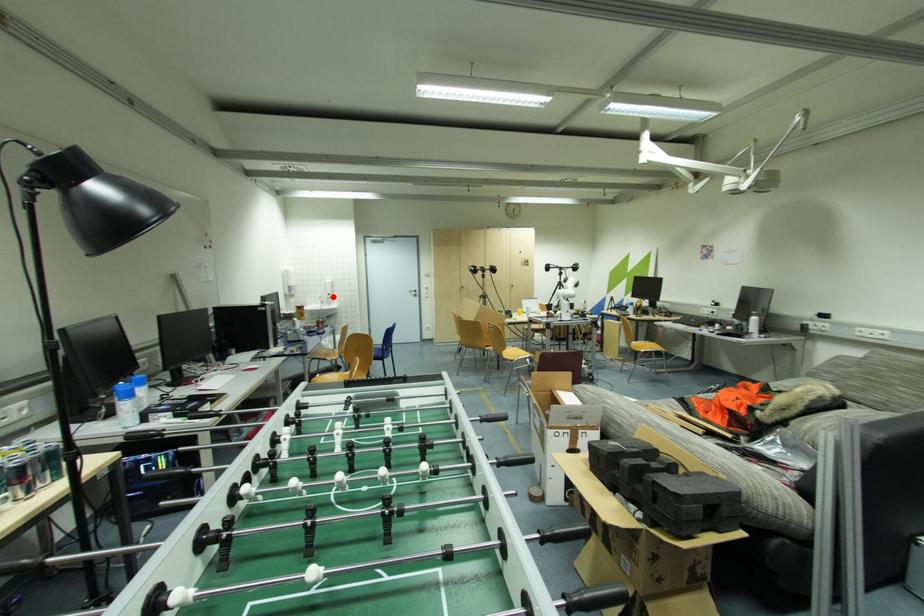
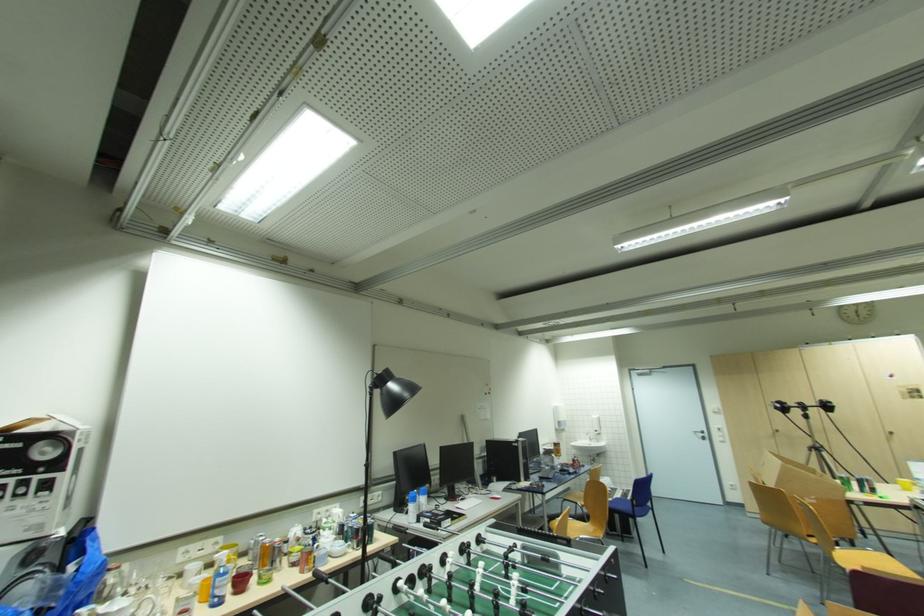
The point at the highlighted location is marked in the first image. Where is the corresponding point in the second image?

(601, 434)